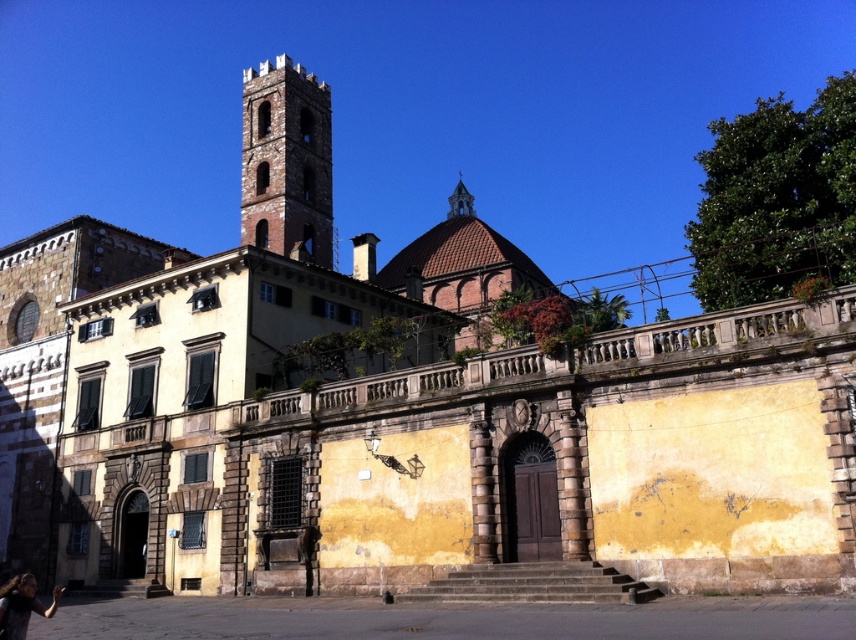
Can you confirm if brown brick bell tower at upper left is thinner than dark hair at lower left?

No, brown brick bell tower at upper left is not thinner than dark hair at lower left.

Can you confirm if brown brick bell tower at upper left is positioned to the left of dark hair at lower left?

Correct, you'll find brown brick bell tower at upper left to the left of dark hair at lower left.

Who is more distant from viewer, (301, 250) or (22, 577)?

Point (301, 250)

This screenshot has height=640, width=856. What are the coordinates of `brown brick bell tower at upper left` in the screenshot? It's located at (286, 161).